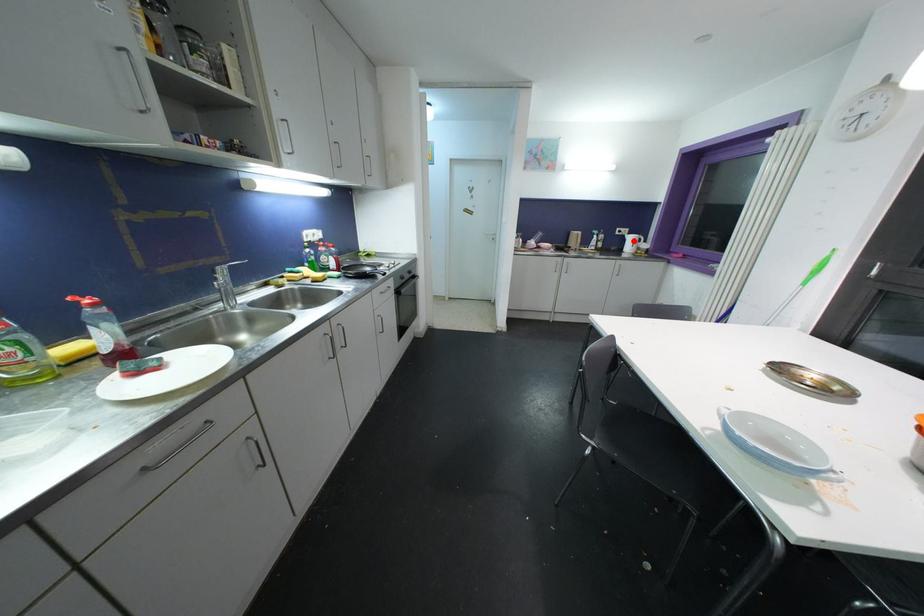
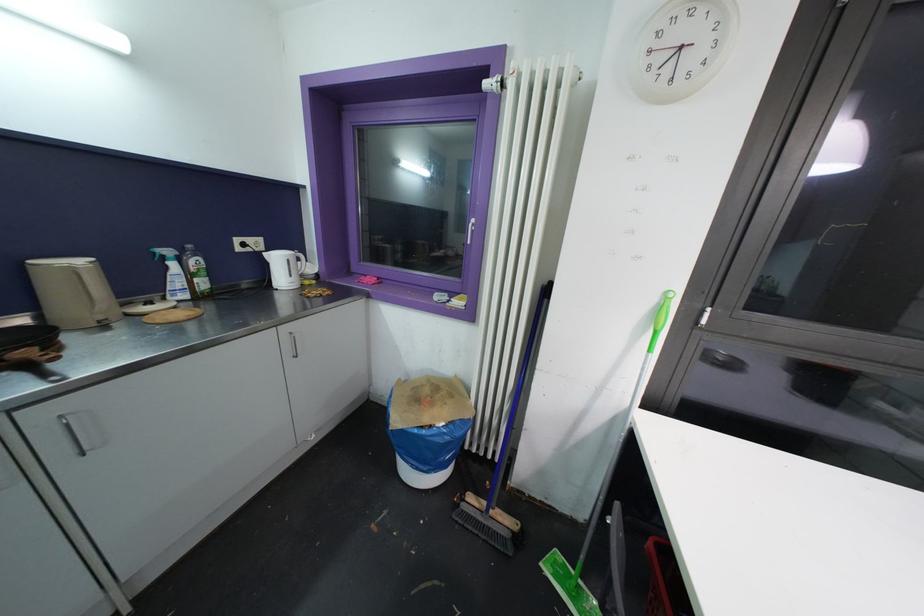
Locate, in the second image, the point that corresponds to the highlighted location in the first image.

(281, 262)